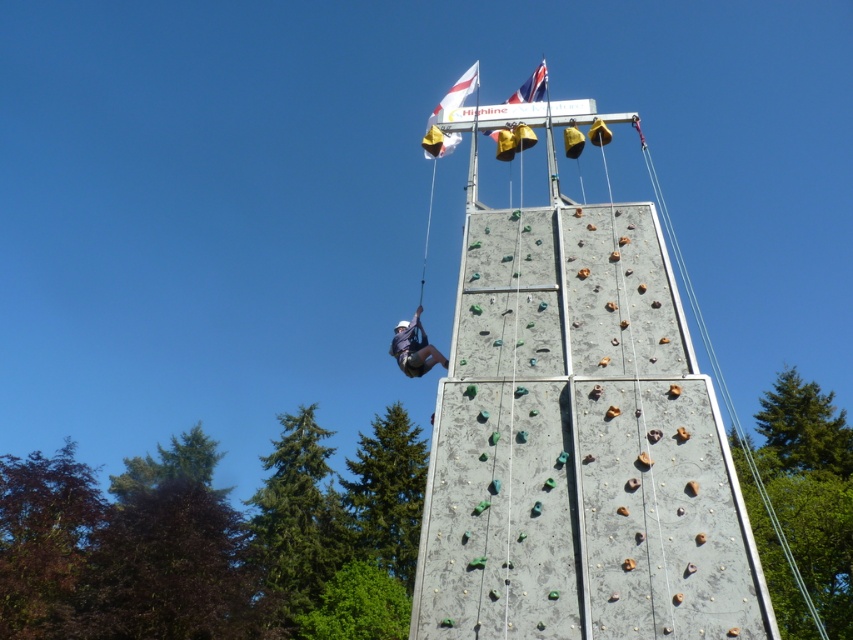
Is concrete climbing wall at center positioned in front of british flag at top?

Yes.

Measure the distance from concrete climbing wall at center to british flag at top.

The distance of concrete climbing wall at center from british flag at top is 9.15 meters.

The height and width of the screenshot is (640, 853). Describe the element at coordinates (577, 442) in the screenshot. I see `concrete climbing wall at center` at that location.

At what (x,y) coordinates should I click in order to perform the action: click on concrete climbing wall at center. Please return your answer as a coordinate pair (x, y). The height and width of the screenshot is (640, 853). Looking at the image, I should click on (577, 442).

Is point (660, 548) in front of point (415, 365)?

Yes, point (660, 548) is in front of point (415, 365).

Between concrete climbing wall at center and white fabric helmet at upper center, which one is positioned higher?

concrete climbing wall at center is above.

Who is more forward, [579,620] or [428,362]?

Point [579,620]

At what (x,y) coordinates should I click in order to perform the action: click on concrete climbing wall at center. Please return your answer as a coordinate pair (x, y). Image resolution: width=853 pixels, height=640 pixels. Looking at the image, I should click on (577, 442).

Does white fabric helmet at upper center have a greater height compared to british flag at top?

In fact, white fabric helmet at upper center may be shorter than british flag at top.

Consider the image. Is white fabric helmet at upper center below british flag at top?

Yes, white fabric helmet at upper center is below british flag at top.

Does point (393, 355) come behind point (543, 77)?

No, (393, 355) is closer to viewer.

This screenshot has height=640, width=853. In order to click on white fabric helmet at upper center in this screenshot , I will do `click(415, 348)`.